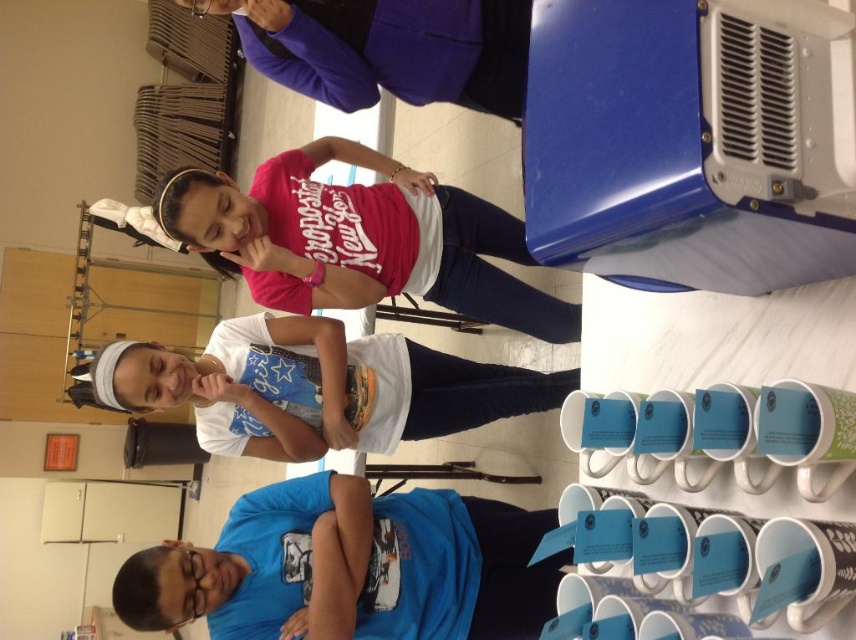
Is matte pink shirt at upper center to the left of white matte t-shirt at center from the viewer's perspective?

In fact, matte pink shirt at upper center is to the right of white matte t-shirt at center.

Does matte pink shirt at upper center come behind white matte t-shirt at center?

No, matte pink shirt at upper center is in front of white matte t-shirt at center.

Is point (307, 289) behind point (263, 428)?

No.

This screenshot has width=856, height=640. Identify the location of matte pink shirt at upper center. (360, 240).

Does white matte t-shirt at center have a smaller size compared to clear plastic goggles at lower left?

No.

The height and width of the screenshot is (640, 856). I want to click on white matte t-shirt at center, so [x=317, y=387].

Between point (201, 442) and point (201, 612), which one is positioned behind?

Point (201, 442)

Where is `white matte t-shirt at center`? The image size is (856, 640). white matte t-shirt at center is located at coordinates (317, 387).

Who is lower down, matte pink shirt at upper center or clear plastic goggles at lower left?

clear plastic goggles at lower left is below.

Is matte pink shirt at upper center below clear plastic goggles at lower left?

No.

Between point (334, 304) and point (191, 614), which one is positioned behind?

The point (334, 304) is more distant.

The image size is (856, 640). Identify the location of matte pink shirt at upper center. (360, 240).